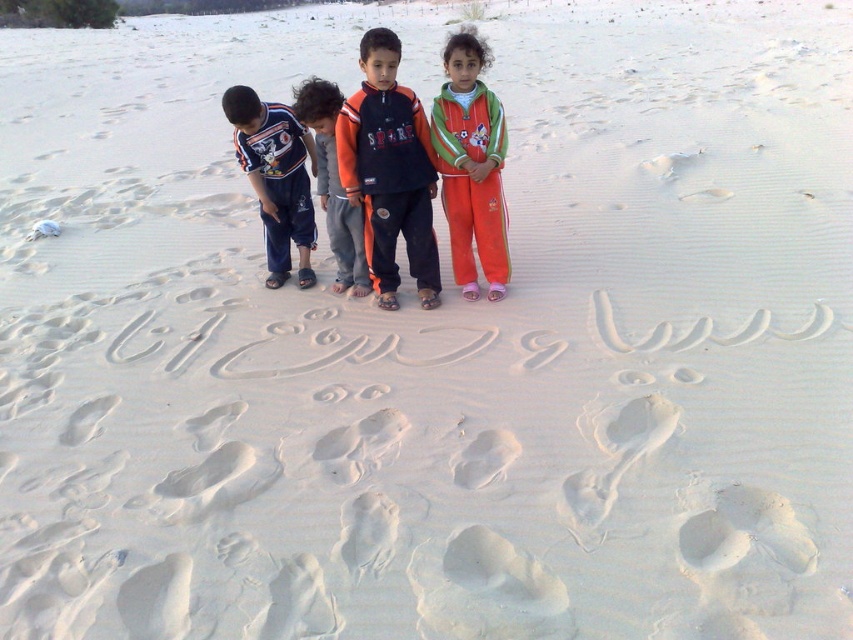
You are standing on the beach and see two points marked on the sand. The first point is at coordinates point [480,84] and the second point is at point [350,273]. Which point is closer to you?

Point [480,84] is closer to the viewer than point [350,273].

You are a photographer trying to capture a photo of the orange fleece tracksuit at center and the orange cotton pants at left. Since both are orange, you need to adjust your camera angle to distinguish them. Based on their positions, which one should you focus on first to ensure both are in the frame?

The orange fleece tracksuit at center is above the orange cotton pants at left, so you should focus on the orange fleece tracksuit at center first to ensure both are in the frame.